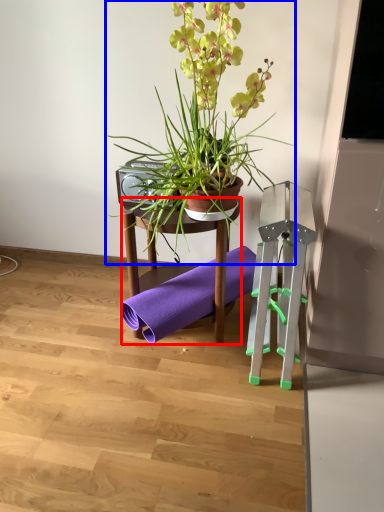
Question: Which object is further to the camera taking this photo, furniture (highlighted by a red box) or houseplant (highlighted by a blue box)?

Choices:
 (A) furniture
 (B) houseplant

Answer: (A)